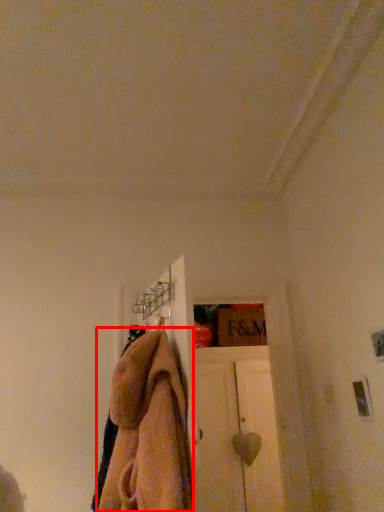
Question: Observing the image, what is the correct spatial positioning of towel (annotated by the red box) in reference to door?

Choices:
 (A) left
 (B) right

Answer: (A)